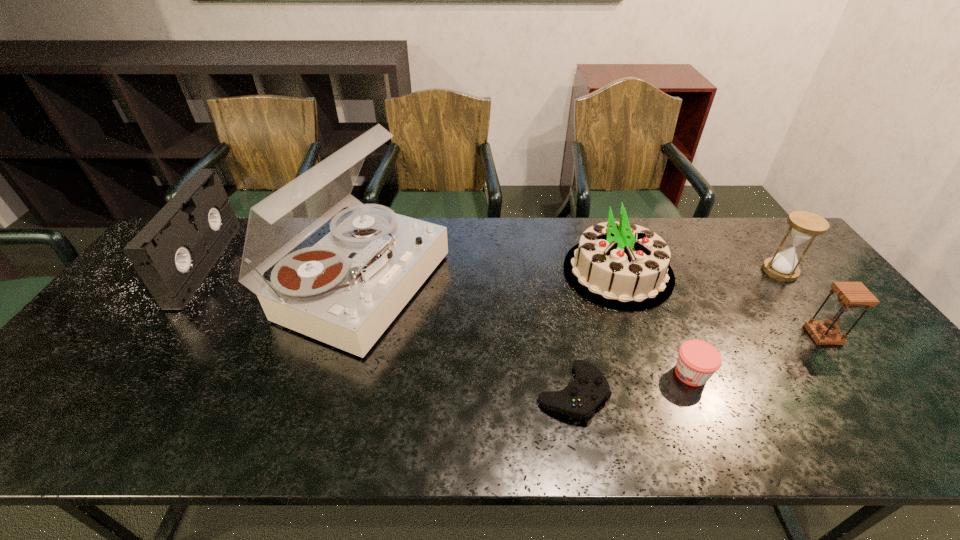
At what (x,y) coordinates should I click in order to perform the action: click on free space between the birthday cake and the shortest object. Please return your answer as a coordinate pair (x, y). Looking at the image, I should click on (595, 332).

Locate an element on the screen. The width and height of the screenshot is (960, 540). empty space that is in between the leftmost object and the control is located at coordinates (389, 328).

Locate an element on the screen. vacant space that's between the jam and the fifth tallest object is located at coordinates (757, 354).

This screenshot has height=540, width=960. I want to click on empty space between the second object from left to right and the sixth tallest object, so click(525, 329).

You are a GUI agent. You are given a task and a screenshot of the screen. Output one action in this format:
    pyautogui.click(x=<x>, y=<y>)
    Task: Click on the free area in between the farther hourglass and the control
    The image size is (960, 540).
    Given the screenshot: What is the action you would take?
    pyautogui.click(x=676, y=332)

At what (x,y) coordinates should I click in order to perform the action: click on free space that is in between the birthday cake and the shortest object. Please return your answer as a coordinate pair (x, y). This screenshot has width=960, height=540. Looking at the image, I should click on (595, 332).

Choose which object is the fourth nearest neighbor to the shortest object. Please provide its 2D coordinates. Your answer should be formatted as a tuple, i.e. [(x, y)], where the tuple contains the x and y coordinates of a point satisfying the conditions above.

[(851, 295)]

You are a GUI agent. You are given a task and a screenshot of the screen. Output one action in this format:
    pyautogui.click(x=<x>, y=<y>)
    Task: Click on the object that stands as the third closest to the birthday cake
    Image resolution: width=960 pixels, height=540 pixels.
    Given the screenshot: What is the action you would take?
    pyautogui.click(x=804, y=226)

At what (x,y) coordinates should I click in order to perform the action: click on free space that satisfies the following two spatial constraints: 1. on the back side of the nearer hourglass; 2. on the left side of the farther hourglass. Please return your answer as a coordinate pair (x, y). This screenshot has height=540, width=960. Looking at the image, I should click on (775, 271).

Identify the location of vacant space that satisfies the following two spatial constraints: 1. on the back side of the record player; 2. on the side of the videotape with visible spindles. (366, 265).